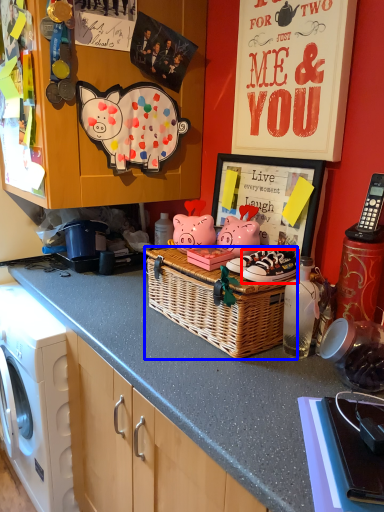
Question: Which object is closer to the camera taking this photo, footwear (highlighted by a red box) or picnic basket (highlighted by a blue box)?

Choices:
 (A) footwear
 (B) picnic basket

Answer: (B)